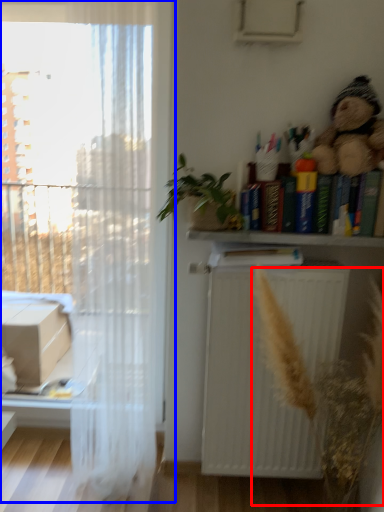
Question: Which of the following is the closest to the observer, plant (highlighted by a red box) or window (highlighted by a blue box)?

Choices:
 (A) plant
 (B) window

Answer: (A)